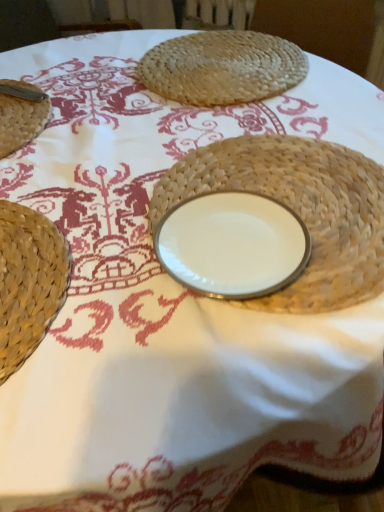
The height and width of the screenshot is (512, 384). I want to click on vacant space that is to the left of woven straw placemat at upper center, so [x=82, y=82].